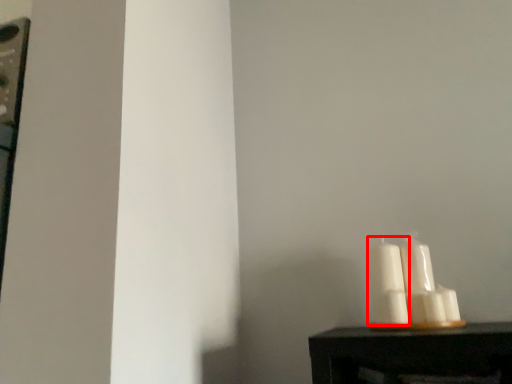
Question: From the image's perspective, what is the correct spatial relationship of candle (annotated by the red box) in relation to candle?

Choices:
 (A) above
 (B) below

Answer: (A)